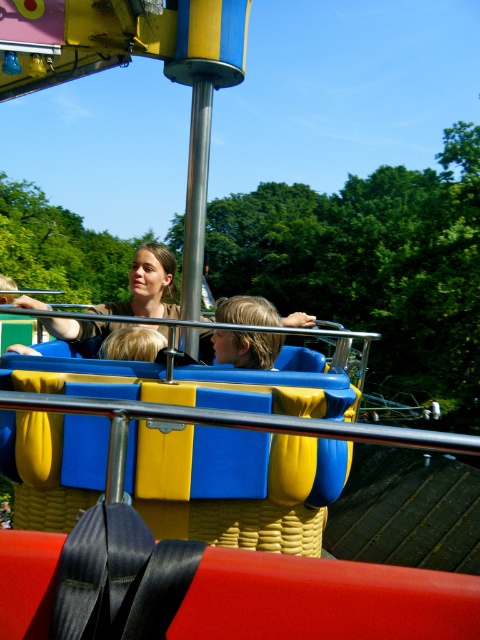
Question: Which point appears farthest from the camera in this image?

Choices:
 (A) (240, 360)
 (B) (108, 308)

Answer: (B)

Question: Which object is farther from the camera taking this photo?

Choices:
 (A) matte brown shirt at center
 (B) blonde hair at center

Answer: (B)

Question: Is matte brown shirt at center further to camera compared to blonde hair at center?

Choices:
 (A) no
 (B) yes

Answer: (A)

Question: Does matte brown shirt at center have a lesser width compared to blonde hair at center?

Choices:
 (A) yes
 (B) no

Answer: (B)

Question: Among these points, which one is farthest from the camera?

Choices:
 (A) (171, 282)
 (B) (262, 333)

Answer: (A)

Question: Is matte brown shirt at center behind blonde hair at center?

Choices:
 (A) no
 (B) yes

Answer: (A)